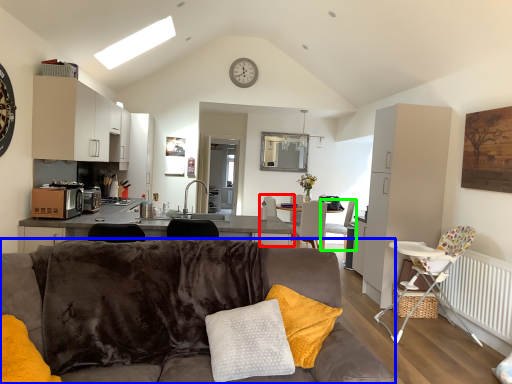
Question: Which object is positioned closest to armchair (highlighted by a red box)? Select from studio couch (highlighted by a blue box) and chair (highlighted by a green box).

Choices:
 (A) studio couch
 (B) chair

Answer: (B)